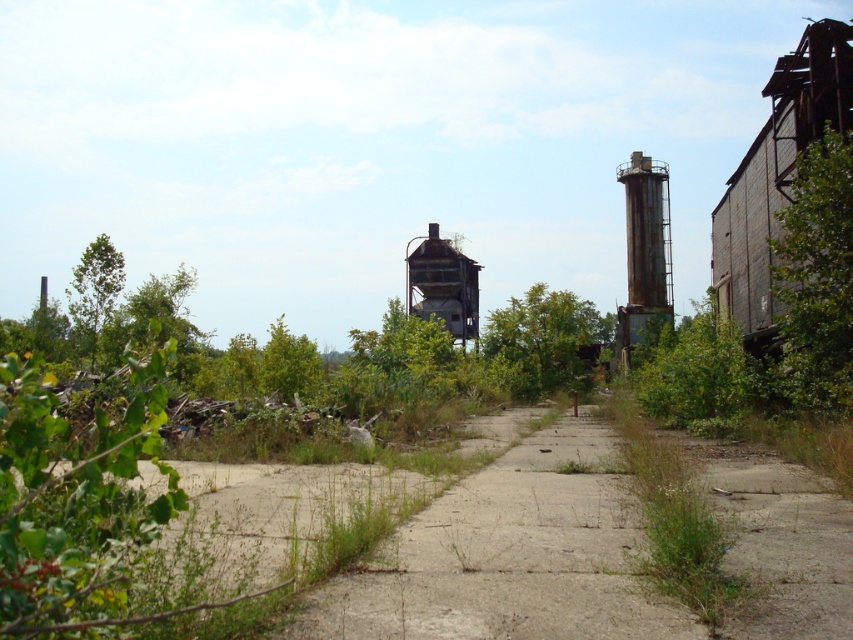
Question: Does dull concrete path at center appear on the left side of rusty metal water tower at right?

Choices:
 (A) yes
 (B) no

Answer: (A)

Question: Which object appears closest to the camera in this image?

Choices:
 (A) green leafy tree at center
 (B) dull concrete path at center

Answer: (B)

Question: Is dull concrete path at center closer to the viewer compared to rusty metal water tower at right?

Choices:
 (A) yes
 (B) no

Answer: (A)

Question: Among these objects, which one is nearest to the camera?

Choices:
 (A) rusty metal water tower at right
 (B) rusty metal water tower at center
 (C) green leafy tree at center

Answer: (C)

Question: Is dull concrete path at center bigger than rusty metal water tower at right?

Choices:
 (A) no
 (B) yes

Answer: (A)

Question: Which point appears closest to the camera in this image?

Choices:
 (A) (639, 616)
 (B) (552, 292)
 (C) (459, 291)
 (D) (639, 208)

Answer: (A)